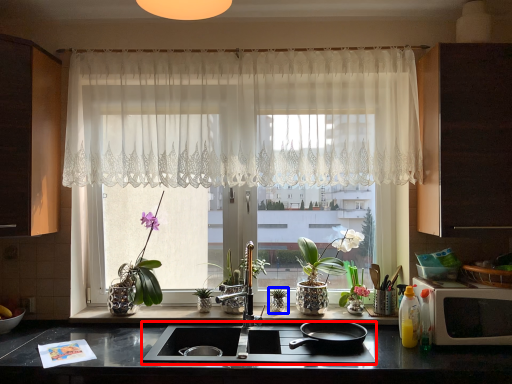
Question: Which of the following is the farthest to the observer, gas stove (highlighted by a red box) or plant (highlighted by a blue box)?

Choices:
 (A) gas stove
 (B) plant

Answer: (B)